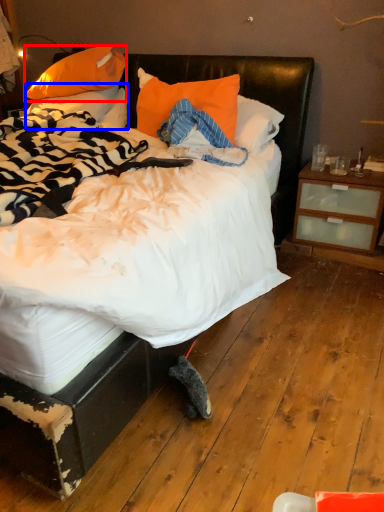
Question: Which of the following is the closest to the observer, pillow (highlighted by a red box) or pillow (highlighted by a blue box)?

Choices:
 (A) pillow
 (B) pillow

Answer: (A)